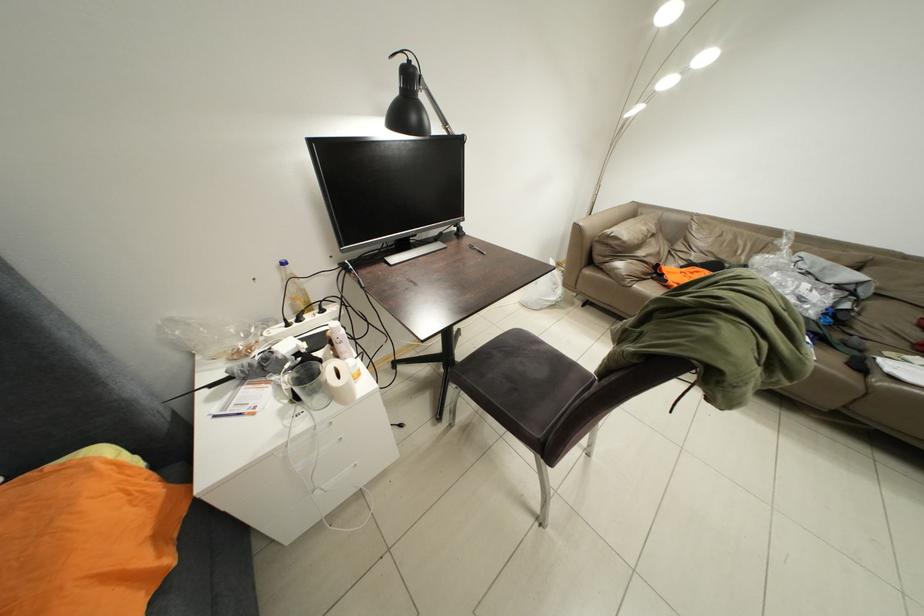
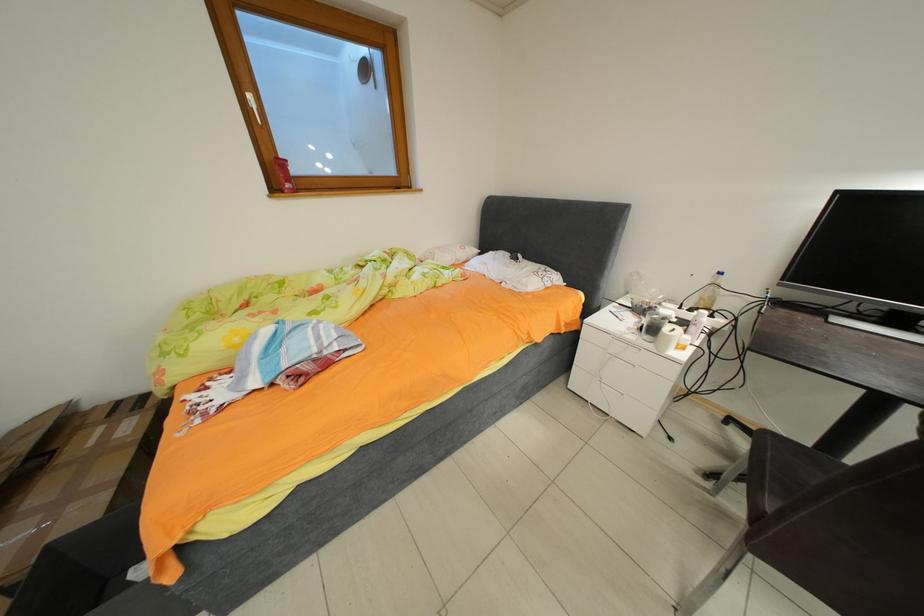
In the scene shown: First-person continuous shooting, in which direction is the camera rotating?

The camera rotated toward left-down.